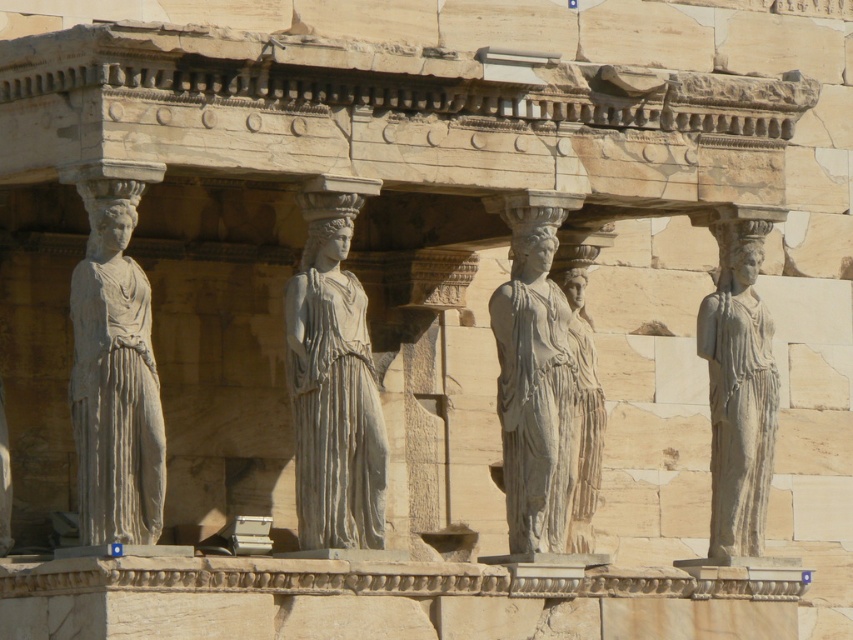
Question: Among these points, which one is nearest to the camera?

Choices:
 (A) (532, 221)
 (B) (318, 540)
 (C) (73, 369)
 (D) (740, 445)

Answer: (B)

Question: Based on their relative distances, which object is nearer to the light gray stone caryatid at left?

Choices:
 (A) gray stone statue at right
 (B) gray stone statue at center
 (C) white marble statue at center

Answer: (C)

Question: Is white marble statue at center closer to the viewer compared to gray stone statue at center?

Choices:
 (A) yes
 (B) no

Answer: (A)

Question: Which point is closer to the camera?

Choices:
 (A) light gray stone caryatid at left
 (B) gray stone statue at right
 (C) gray stone statue at center
 (D) white marble statue at center

Answer: (A)

Question: From the image, what is the correct spatial relationship of white marble statue at center in relation to gray stone statue at center?

Choices:
 (A) below
 (B) above

Answer: (A)

Question: Does white marble statue at center have a greater width compared to gray stone statue at right?

Choices:
 (A) no
 (B) yes

Answer: (A)